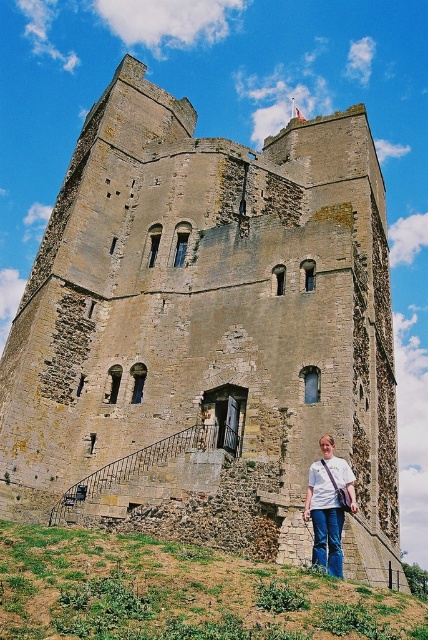
You are a painter standing on the green grassy hillside at lower left and want to paint the white cotton shirt at lower center. Since you need to see the entire shirt clearly, will you have to climb higher or stay where you are?

The green grassy hillside at lower left is not as tall as the white cotton shirt at lower center, so you will have to climb higher to ensure you can see the entire shirt clearly.

You are standing at the base of the historic stone tower and want to take a photo of the tower with the green grassy hillside at lower left in the background. To ensure the grassy hillside is visible, where should you position yourself relative to the point labeled point (178, 593)?

You should position yourself to the right of point (178, 593) because the point is located on the green grassy hillside at lower left, so standing to its right would keep the hillside in the background behind the tower.

You are a photographer planning to take a picture of the historic stone tower. You want to ensure both the green grassy hillside at lower left and the white cotton shirt at lower center are clearly visible in the frame. Considering their sizes, which object should you focus on to ensure both are in focus?

The green grassy hillside at lower left has a larger size compared to the white cotton shirt at lower center. To ensure both are in focus, you should focus on the green grassy hillside at lower left since it is larger and will require more depth of field to capture details.